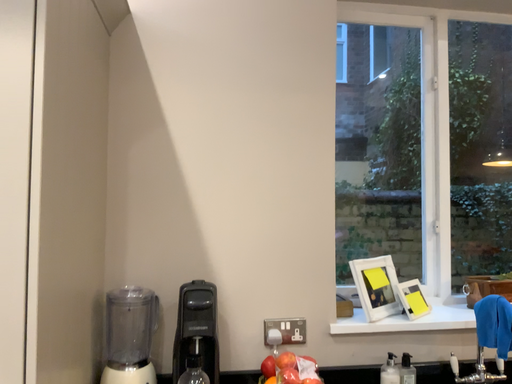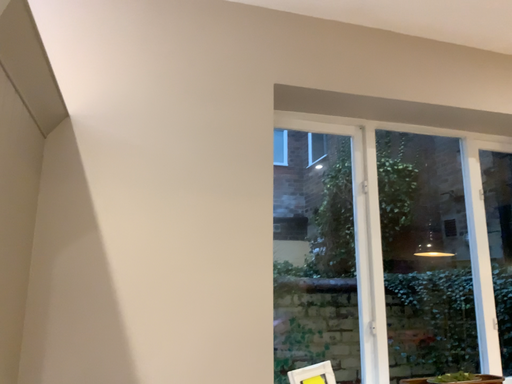
Question: Which way did the camera rotate in the video?

Choices:
 (A) rotated right
 (B) rotated left

Answer: (A)